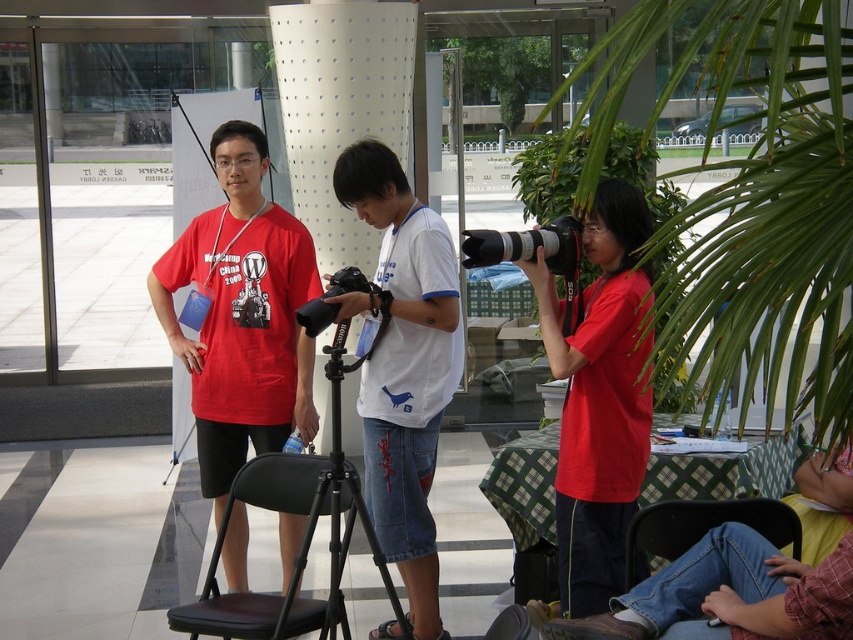
Question: Does matte red shirt at center appear under black rubber camera at center?

Choices:
 (A) yes
 (B) no

Answer: (A)

Question: Is the position of matte black camera at center more distant than that of black rubber camera at center?

Choices:
 (A) yes
 (B) no

Answer: (B)

Question: Is black metal tripod at center above black rubber camera at center?

Choices:
 (A) yes
 (B) no

Answer: (B)

Question: Which is farther from the matte red shirt at center?

Choices:
 (A) matte black camera at center
 (B) matte red t-shirt at left
 (C) white cotton t-shirt at center
 (D) black metal tripod at center

Answer: (B)

Question: Estimate the real-world distances between objects in this image. Which object is closer to the matte red t-shirt at left?

Choices:
 (A) matte black camera at center
 (B) black metal tripod at center
 (C) white cotton t-shirt at center
 (D) black rubber camera at center

Answer: (C)

Question: Which point is closer to the camera taking this photo?

Choices:
 (A) (573, 221)
 (B) (555, 499)
 (C) (419, 289)

Answer: (A)